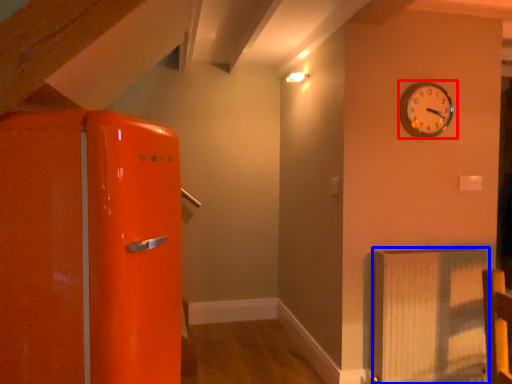
Question: Which object appears farthest to the camera in this image, wall clock (highlighted by a red box) or radiator (highlighted by a blue box)?

Choices:
 (A) wall clock
 (B) radiator

Answer: (A)